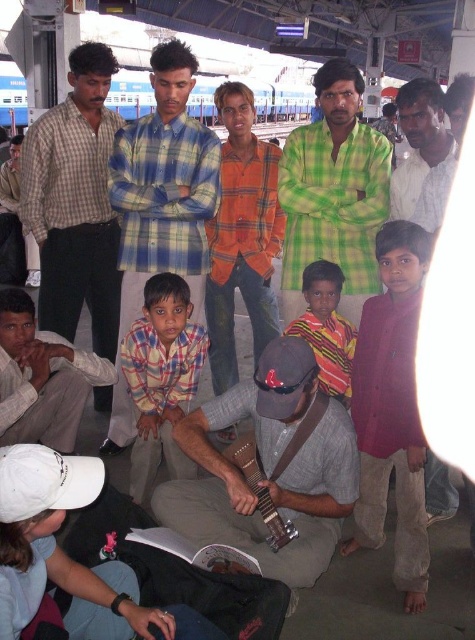
Between gray fabric guitar at center and green plaid shirt at center, which one has more height?

green plaid shirt at center

Describe the element at coordinates (269, 467) in the screenshot. I see `gray fabric guitar at center` at that location.

This screenshot has width=475, height=640. In order to click on gray fabric guitar at center in this screenshot , I will do `click(269, 467)`.

Is checkered fabric shirt at center positioned before light brown shirt at center?

Yes, checkered fabric shirt at center is closer to the viewer.

Is checkered fabric shirt at center smaller than light brown shirt at center?

No.

Identify the location of checkered fabric shirt at center. Image resolution: width=475 pixels, height=640 pixels. (161, 376).

Can you confirm if blue plaid shirt at center is thinner than checkered fabric shirt at center?

No.

From the picture: Who is more forward, (x=195, y=288) or (x=186, y=476)?

Point (x=186, y=476) is more forward.

Between point (158, 234) and point (180, 304), which one is positioned behind?

The point (158, 234) is more distant.

Image resolution: width=475 pixels, height=640 pixels. Identify the location of blue plaid shirt at center. (161, 204).